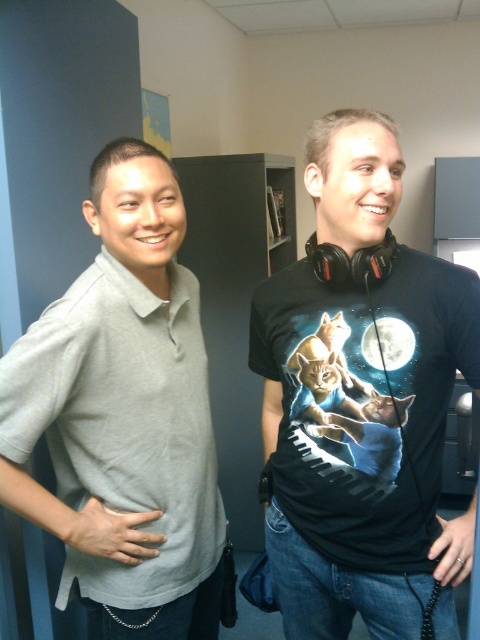
You are standing in an office and see two points marked in the image. The first point is at coordinate point (350, 150) and the second is at point (214, 634). Which point is closer to you?

Point (350, 150) is closer to the viewer than point (214, 634).